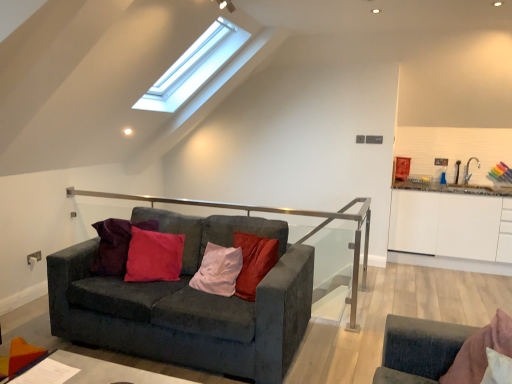
This screenshot has width=512, height=384. Describe the element at coordinates (188, 303) in the screenshot. I see `velvet dark gray couch at center` at that location.

At what (x,y) coordinates should I click in order to perform the action: click on smooth gray table at lower left. Please return your answer as a coordinate pair (x, y). Image resolution: width=512 pixels, height=384 pixels. Looking at the image, I should click on (89, 372).

You are a GUI agent. You are given a task and a screenshot of the screen. Output one action in this format:
    pyautogui.click(x=<x>, y=<y>)
    Task: Click on the velvet dark gray couch at center
    Image resolution: width=512 pixels, height=384 pixels.
    Given the screenshot: What is the action you would take?
    pyautogui.click(x=188, y=303)

Considering the relative positions of white glossy cabinet at right and smooth gray table at lower left in the image provided, is white glossy cabinet at right behind smooth gray table at lower left?

Yes, the depth of white glossy cabinet at right is greater than that of smooth gray table at lower left.

Which of these two, white glossy cabinet at right or smooth gray table at lower left, is wider?

smooth gray table at lower left is wider.

Looking at this image, between white glossy cabinet at right and smooth gray table at lower left, which one appears on the right side from the viewer's perspective?

white glossy cabinet at right is more to the right.

What's the angular difference between white glossy cabinet at right and smooth gray table at lower left's facing directions?

white glossy cabinet at right and smooth gray table at lower left are facing 91.5 degrees away from each other.

Is white glossy cabinet at right located outside velvet dark gray couch at center?

Yes.

From the image's perspective, who appears lower, white glossy cabinet at right or velvet dark gray couch at center?

velvet dark gray couch at center, from the image's perspective.

Is white glossy cabinet at right smaller than velvet dark gray couch at center?

Yes, white glossy cabinet at right is smaller than velvet dark gray couch at center.

Which point is more forward, (67, 299) or (511, 213)?

The point (67, 299) is in front.

Can you tell me how much velvet dark gray couch at center and white glossy cabinet at right differ in facing direction?

The angular difference between velvet dark gray couch at center and white glossy cabinet at right is 2.03 degrees.

Is velvet dark gray couch at center with white glossy cabinet at right?

No, velvet dark gray couch at center is not in contact with white glossy cabinet at right.

Is velvet dark gray couch at center turned away from white glossy cabinet at right?

That's not correct — velvet dark gray couch at center is not looking away from white glossy cabinet at right.

Consider the image. Who is more distant, smooth gray table at lower left or white glossy cabinet at right?

white glossy cabinet at right.

How different are the orientations of smooth gray table at lower left and white glossy cabinet at right in degrees?

The angular difference between smooth gray table at lower left and white glossy cabinet at right is 91.5 degrees.

The image size is (512, 384). In order to click on table that appears below the white glossy cabinet at right (from the image's perspective) in this screenshot , I will do `click(89, 372)`.

Is smooth gray table at lower left oriented towards white glossy cabinet at right?

No, smooth gray table at lower left does not turn towards white glossy cabinet at right.

This screenshot has height=384, width=512. Identify the location of studio couch that appears behind the smooth gray table at lower left. (188, 303).

Is smooth gray table at lower left surrounded by velvet dark gray couch at center?

Actually, smooth gray table at lower left is outside velvet dark gray couch at center.

Considering the relative sizes of velvet dark gray couch at center and smooth gray table at lower left in the image provided, is velvet dark gray couch at center shorter than smooth gray table at lower left?

Incorrect, the height of velvet dark gray couch at center does not fall short of that of smooth gray table at lower left.

Considering the positions of objects velvet dark gray couch at center and smooth gray table at lower left in the image provided, who is more to the right, velvet dark gray couch at center or smooth gray table at lower left?

Positioned to the right is velvet dark gray couch at center.

Which is closer, (67,366) or (189,217)?

The point (67,366) is in front.

Is smooth gray table at lower left taller than velvet dark gray couch at center?

No.

Looking at this image, do you think smooth gray table at lower left is within velvet dark gray couch at center, or outside of it?

smooth gray table at lower left cannot be found inside velvet dark gray couch at center.

Image resolution: width=512 pixels, height=384 pixels. I want to click on table in front of the white glossy cabinet at right, so click(89, 372).

Locate an element on the screen. The width and height of the screenshot is (512, 384). cabinetry located above the velvet dark gray couch at center (from a real-world perspective) is located at coordinates (450, 225).

From the image, which object appears to be farther from white glossy cabinet at right, velvet dark gray couch at center or smooth gray table at lower left?

smooth gray table at lower left.

Based on their spatial positions, is smooth gray table at lower left or white glossy cabinet at right further from velvet dark gray couch at center?

white glossy cabinet at right is further to velvet dark gray couch at center.

Looking at the image, which one is located further to white glossy cabinet at right, smooth gray table at lower left or velvet dark gray couch at center?

Among the two, smooth gray table at lower left is located further to white glossy cabinet at right.

Estimate the real-world distances between objects in this image. Which object is closer to smooth gray table at lower left, white glossy cabinet at right or velvet dark gray couch at center?

The object closer to smooth gray table at lower left is velvet dark gray couch at center.

From the image, which object appears to be farther from smooth gray table at lower left, velvet dark gray couch at center or white glossy cabinet at right?

Based on the image, white glossy cabinet at right appears to be further to smooth gray table at lower left.

Which object lies nearer to the anchor point velvet dark gray couch at center, white glossy cabinet at right or smooth gray table at lower left?

smooth gray table at lower left lies closer to velvet dark gray couch at center than the other object.

This screenshot has width=512, height=384. Identify the location of studio couch located between smooth gray table at lower left and white glossy cabinet at right in the left-right direction. coord(188,303).